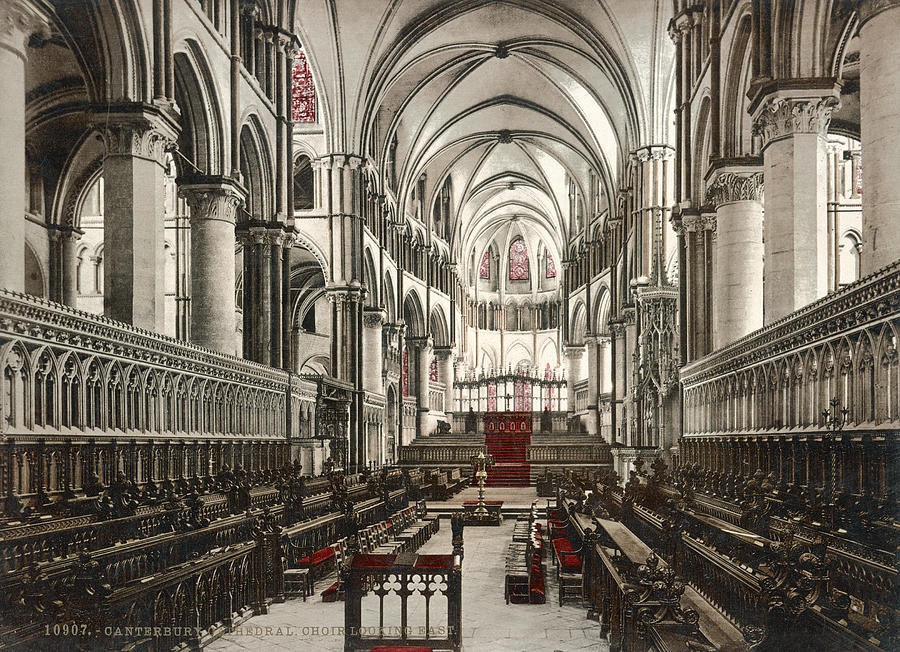
You are a GUI agent. You are given a task and a screenshot of the screen. Output one action in this format:
    pyautogui.click(x=<x>, y=<y>)
    Task: Click on the stairs
    The image size is (900, 652).
    Given the screenshot: What is the action you would take?
    pyautogui.click(x=570, y=435)